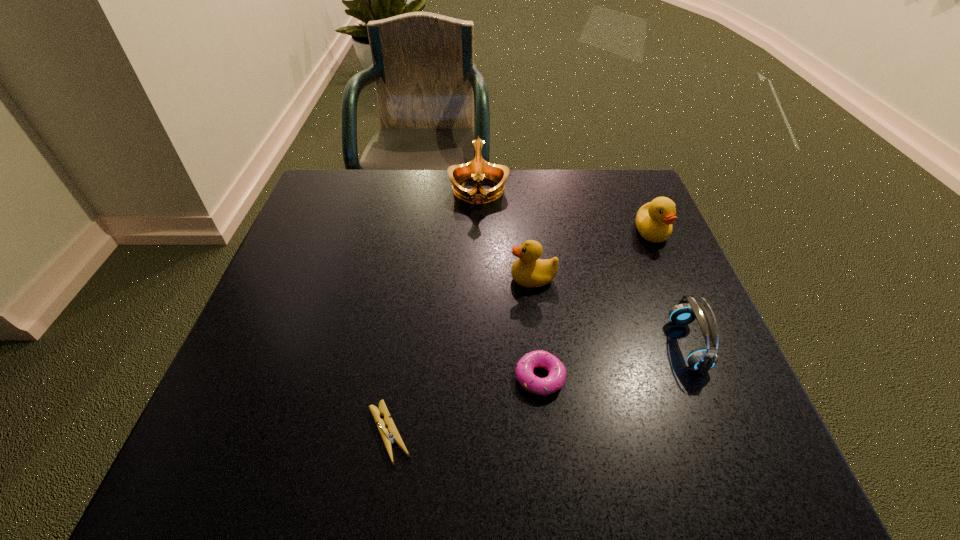
In the image, there is a desktop. Identify the location of vacant space at the near left corner. Image resolution: width=960 pixels, height=540 pixels. (220, 470).

This screenshot has height=540, width=960. In the image, there is a desktop. In order to click on vacant space at the far right corner in this screenshot , I will do `click(591, 193)`.

Where is `free space between the nearer duck and the farthest object`? This screenshot has width=960, height=540. free space between the nearer duck and the farthest object is located at coordinates (506, 235).

Image resolution: width=960 pixels, height=540 pixels. Identify the location of vacant area that lies between the tiara and the headset. (583, 268).

Locate an element on the screen. vacant area between the shortest object and the fourth nearest object is located at coordinates (461, 356).

Identify the location of free area in between the tiara and the left duck. (506, 235).

Where is `free space that is in between the headset and the fourth nearest object`? This screenshot has width=960, height=540. free space that is in between the headset and the fourth nearest object is located at coordinates (611, 312).

This screenshot has height=540, width=960. I want to click on vacant space that's between the doughnut and the shortest object, so click(465, 405).

The height and width of the screenshot is (540, 960). Identify the location of free space between the tiara and the doughnut. (509, 284).

Locate which object ranks second in proximity to the second shortest object. Please provide its 2D coordinates. Your answer should be formatted as a tuple, i.e. [(x, y)], where the tuple contains the x and y coordinates of a point satisfying the conditions above.

[(394, 436)]